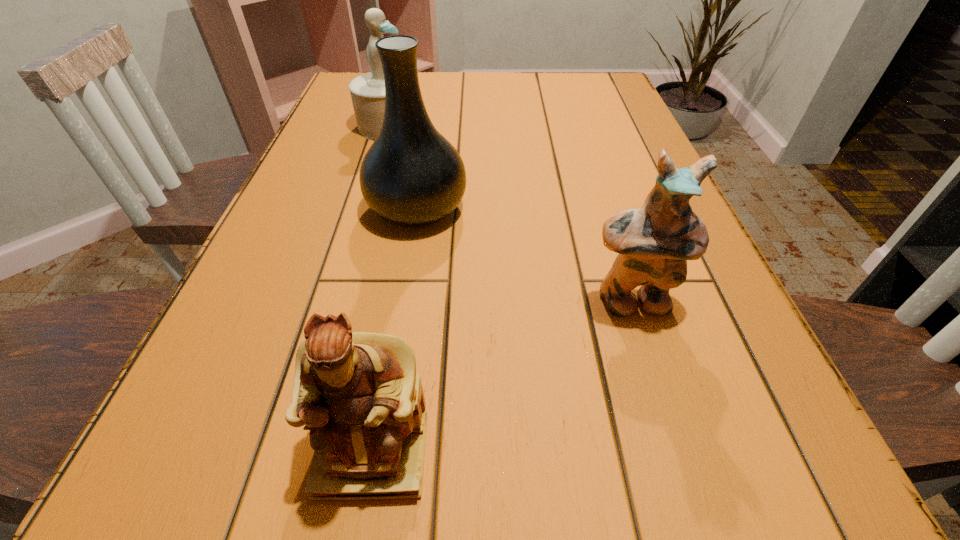
I want to click on free space that satisfies the following two spatial constraints: 1. on the back side of the vase; 2. at the beak of the farthest object, so click(x=430, y=126).